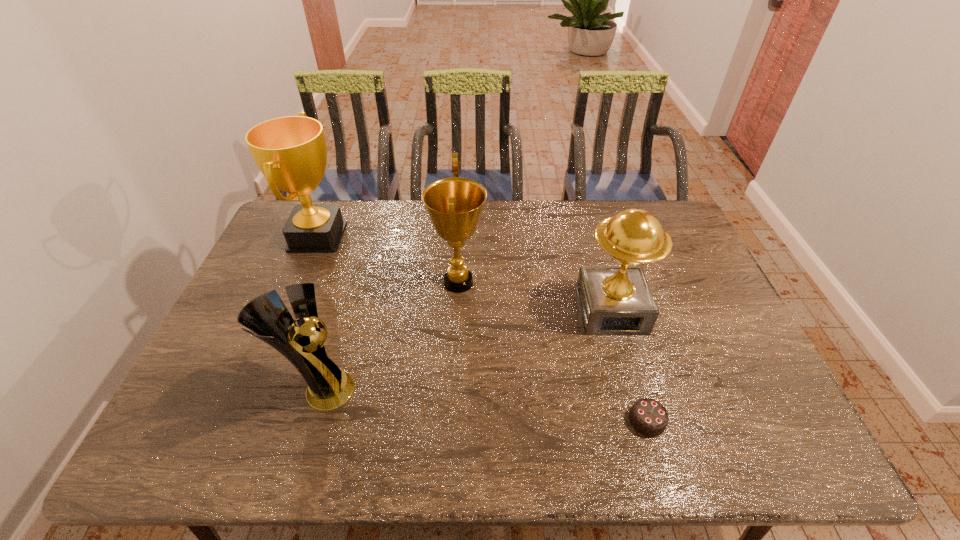
This screenshot has height=540, width=960. Find the location of `free point that satisfies the following two spatial constraints: 1. on the front-facing side of the chocolate cake; 2. on the left side of the rightmost award`. free point that satisfies the following two spatial constraints: 1. on the front-facing side of the chocolate cake; 2. on the left side of the rightmost award is located at coordinates (642, 421).

The image size is (960, 540). Find the location of `free spot that satisfies the following two spatial constraints: 1. at the front of the nearest award, where the globe is visible; 2. on the back side of the chocolate cake`. free spot that satisfies the following two spatial constraints: 1. at the front of the nearest award, where the globe is visible; 2. on the back side of the chocolate cake is located at coordinates (311, 421).